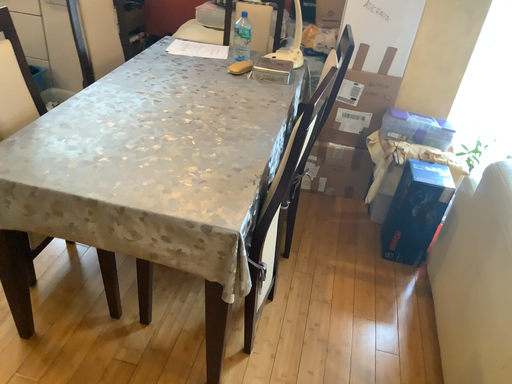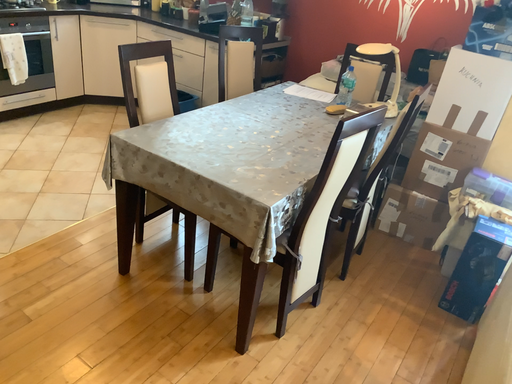
Question: Which way did the camera rotate in the video?

Choices:
 (A) rotated downward
 (B) rotated upward

Answer: (B)